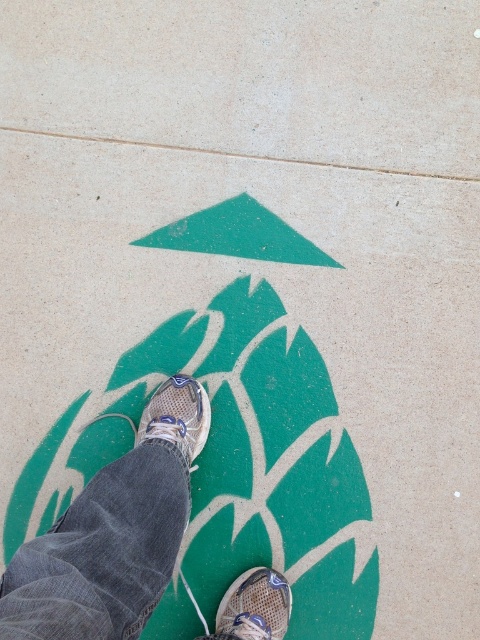
The height and width of the screenshot is (640, 480). Describe the element at coordinates (238, 234) in the screenshot. I see `green matte triangle at center` at that location.

Is green matte triangle at center above mesh athletic shoe at center?

Yes, green matte triangle at center is above mesh athletic shoe at center.

Find the location of `green matte triangle at center`. green matte triangle at center is located at coordinates (238, 234).

Find the location of a particular element. The image size is (480, 640). green matte triangle at center is located at coordinates (238, 234).

Can you confirm if textured beige sneakers at center is shorter than green matte triangle at center?

In fact, textured beige sneakers at center may be taller than green matte triangle at center.

The width and height of the screenshot is (480, 640). What do you see at coordinates (112, 532) in the screenshot?
I see `textured beige sneakers at center` at bounding box center [112, 532].

What are the coordinates of `textured beige sneakers at center` in the screenshot? It's located at (112, 532).

Between point (278, 608) and point (171, 442), which one is positioned in front?

Point (278, 608) is more forward.

Measure the distance between point (x=237, y=627) and camera.

They are 5.08 feet apart.

Where is `mesh athletic shoe at center`? The height and width of the screenshot is (640, 480). mesh athletic shoe at center is located at coordinates [253, 605].